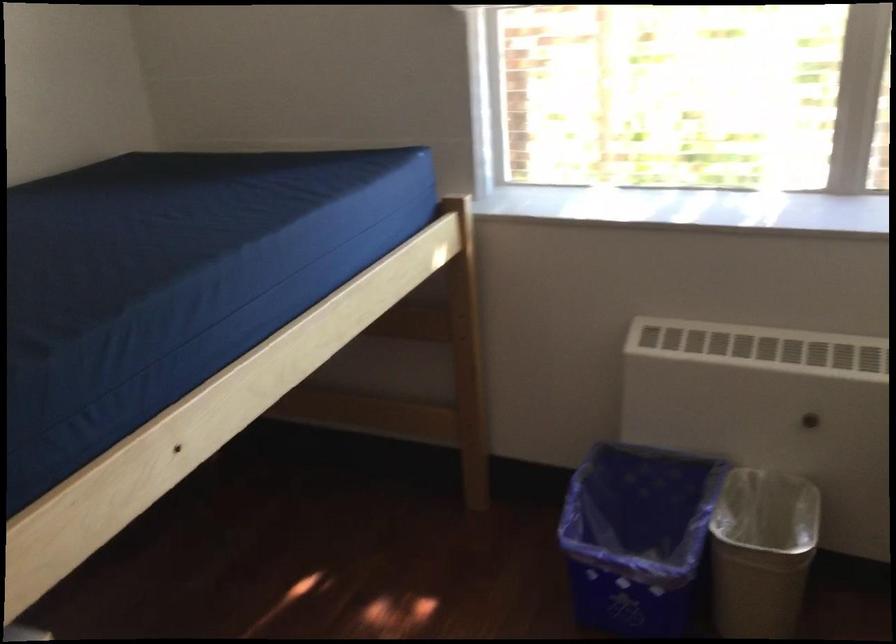
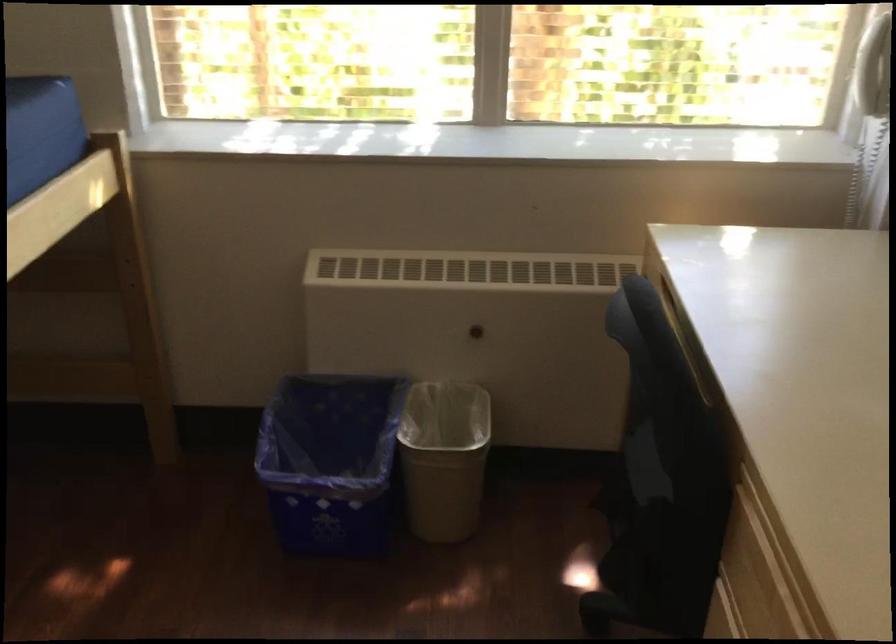
Question: The first image is from the beginning of the video and the second image is from the end. How did the camera likely rotate when shooting the video?

Choices:
 (A) Left
 (B) Right
 (C) Up
 (D) Down

Answer: (B)